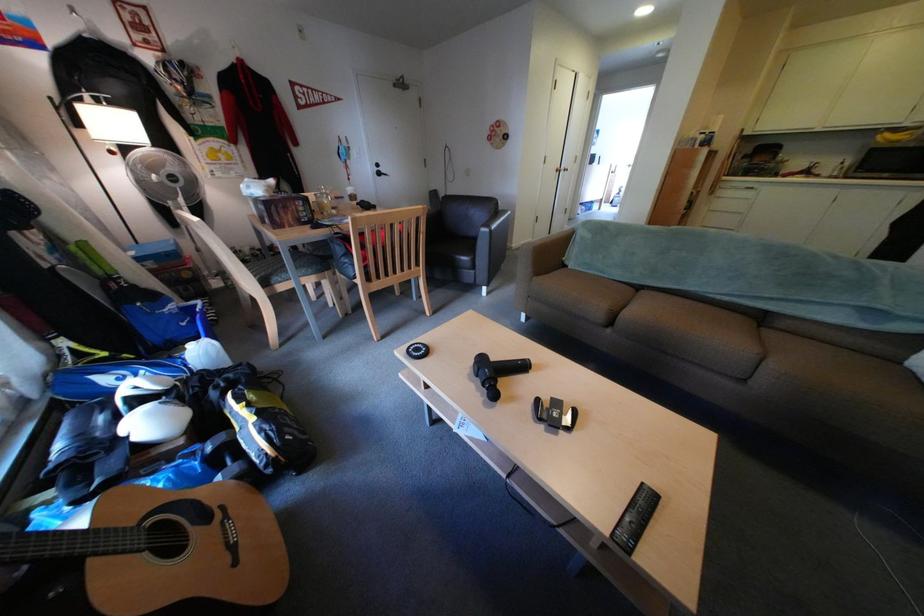
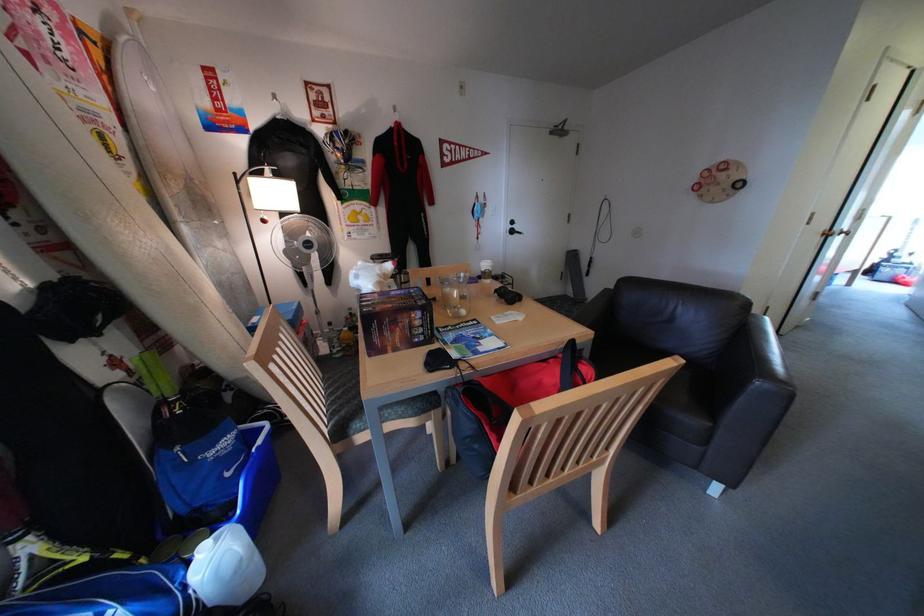
From the picture: Which direction would the cameraman need to move to produce the second image?

The movement direction of the cameraman is left, forward.